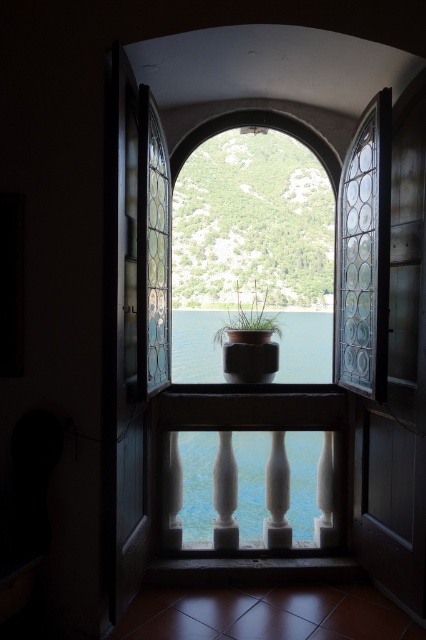
Question: Observing the image, what is the correct spatial positioning of blue glass water at center in reference to green matte pot at center?

Choices:
 (A) below
 (B) above

Answer: (A)

Question: Which object appears farthest from the camera in this image?

Choices:
 (A) green matte pot at center
 (B) blue glass water at center

Answer: (B)

Question: Does blue glass water at center appear on the left side of green matte pot at center?

Choices:
 (A) yes
 (B) no

Answer: (B)

Question: Is blue glass water at center thinner than green matte pot at center?

Choices:
 (A) yes
 (B) no

Answer: (B)

Question: Which point appears farthest from the camera in this image?

Choices:
 (A) (264, 323)
 (B) (325, 323)

Answer: (B)

Question: Among these objects, which one is farthest from the camera?

Choices:
 (A) blue glass water at center
 (B) green matte pot at center

Answer: (A)